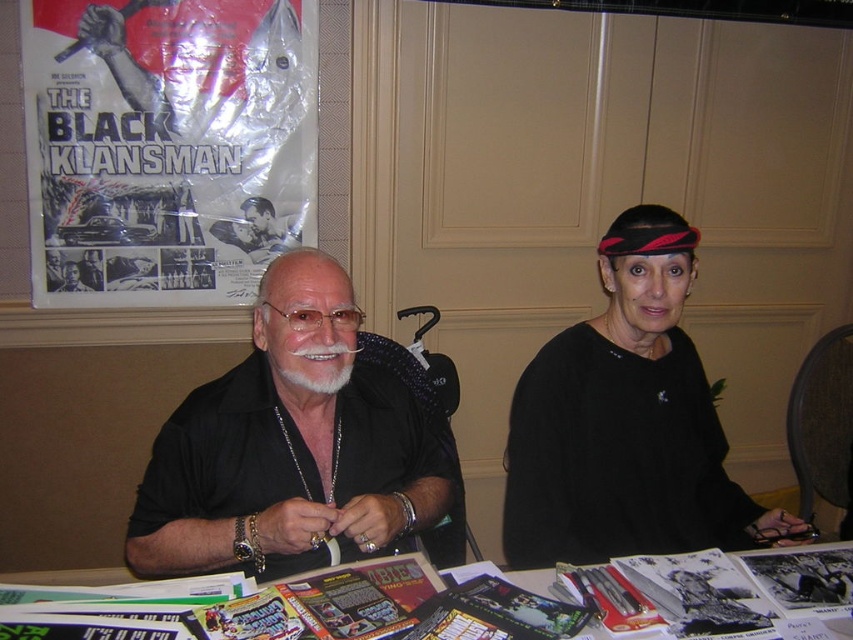
Is black matte shirt at left wider than matte plastic poster at upper left?

Correct, the width of black matte shirt at left exceeds that of matte plastic poster at upper left.

Who is more forward, (x=339, y=544) or (x=62, y=74)?

Point (x=339, y=544) is more forward.

The height and width of the screenshot is (640, 853). What are the coordinates of `black matte shirt at left` in the screenshot? It's located at (291, 449).

Which is below, matte plastic poster at upper left or black matte shirt at center?

black matte shirt at center

Is point (132, 264) more distant than point (253, 445)?

Yes, it is behind point (253, 445).

What do you see at coordinates (166, 147) in the screenshot? This screenshot has height=640, width=853. I see `matte plastic poster at upper left` at bounding box center [166, 147].

The image size is (853, 640). Find the location of `matte plastic poster at upper left`. matte plastic poster at upper left is located at coordinates (166, 147).

Can you confirm if black matte shirt at left is smaller than paper-covered table at center?

Actually, black matte shirt at left might be larger than paper-covered table at center.

Can you confirm if black matte shirt at left is positioned above paper-covered table at center?

Indeed, black matte shirt at left is positioned over paper-covered table at center.

This screenshot has height=640, width=853. Identify the location of black matte shirt at left. (291, 449).